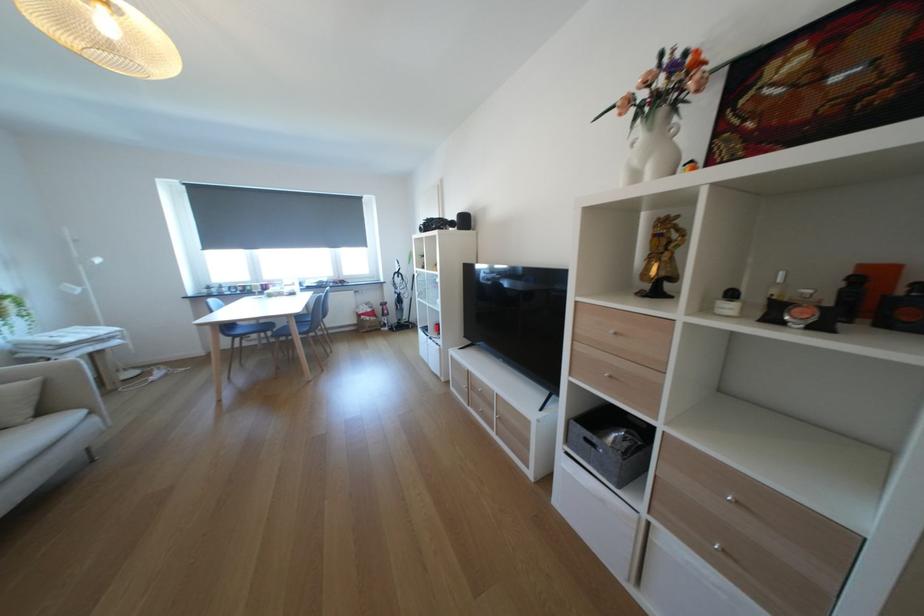
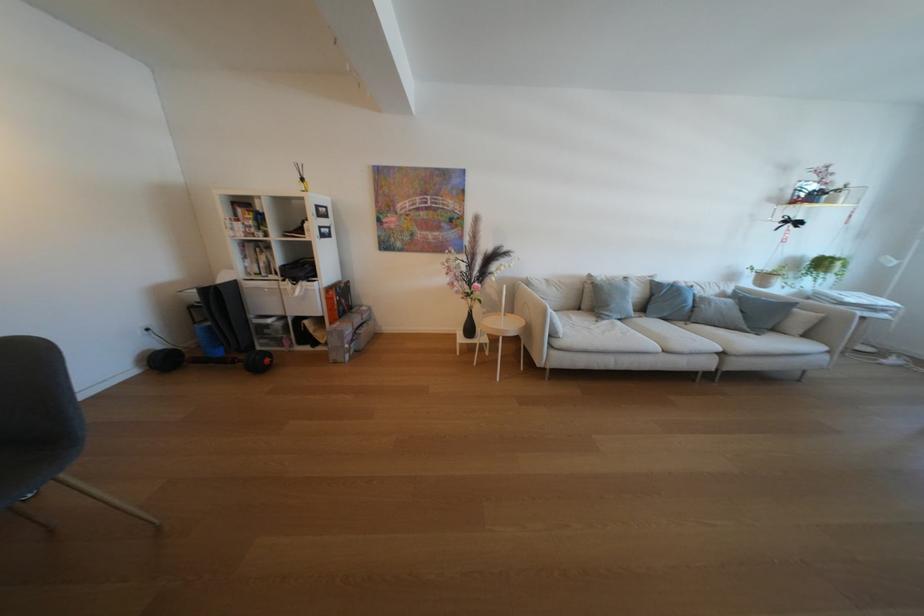
The point at (50, 379) is marked in the first image. Where is the corresponding point in the second image?

(833, 315)